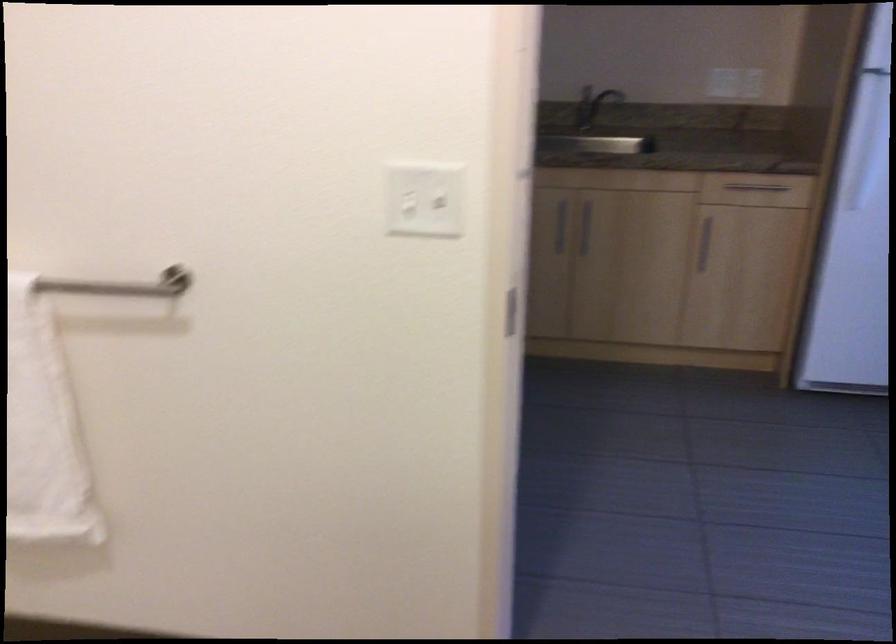
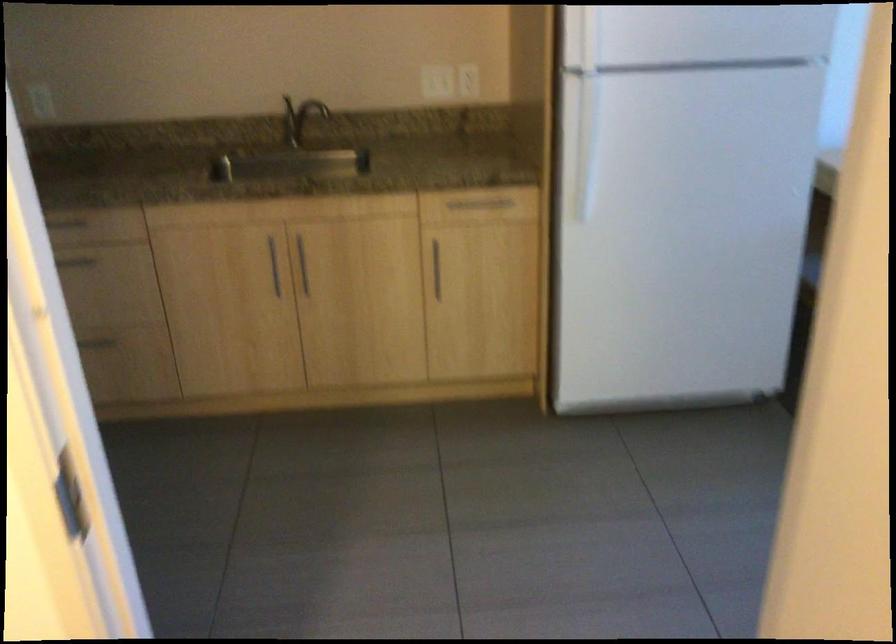
In the second image, find the point that corresponds to pixel 580 100 in the first image.

(299, 118)